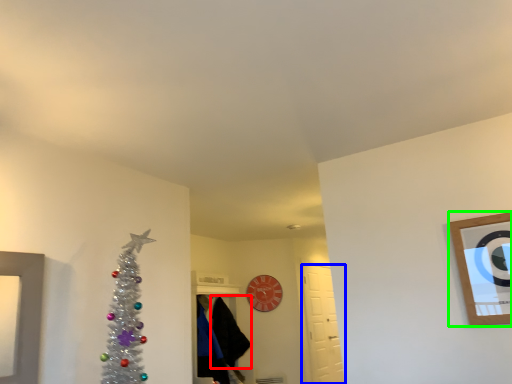
Question: Which object is positioned closest to robe (highlighted by a red box)? Select from door (highlighted by a blue box) and picture frame (highlighted by a green box).

Choices:
 (A) door
 (B) picture frame

Answer: (A)